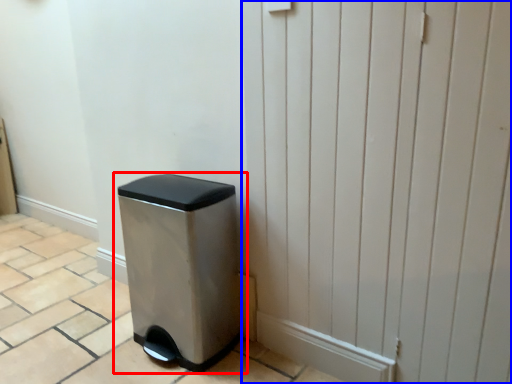
Question: Which object is further to the camera taking this photo, waste container (highlighted by a red box) or screen door (highlighted by a blue box)?

Choices:
 (A) waste container
 (B) screen door

Answer: (A)